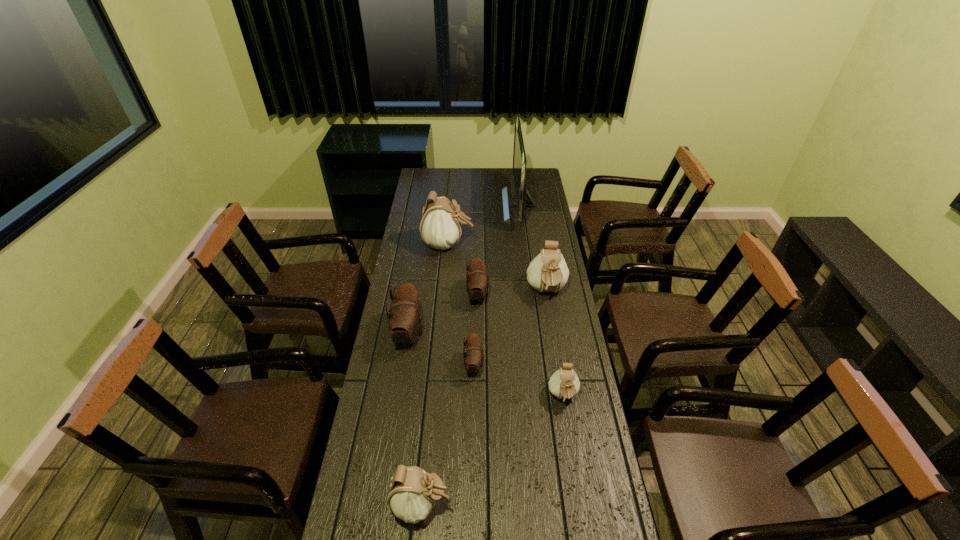
The height and width of the screenshot is (540, 960). What are the coordinates of `object at the far edge` in the screenshot? It's located at (519, 157).

Identify the location of monitor located in the right edge section of the desktop. The width and height of the screenshot is (960, 540). (519, 157).

Find the location of a particular element. object at the far right corner is located at coordinates (519, 157).

Locate an element on the screen. vacant space at the left edge of the desktop is located at coordinates (381, 458).

Identify the location of free spot at the right edge of the desktop. (538, 194).

Where is `vacant space at the far left corner of the desktop`? The width and height of the screenshot is (960, 540). vacant space at the far left corner of the desktop is located at coordinates (420, 182).

Identify the location of free space that is in between the nearest pouch and the farthest brown pouch. This screenshot has height=540, width=960. (449, 400).

At what (x,y) coordinates should I click in order to perform the action: click on vacant space that is in between the third farthest white pouch and the smallest brown pouch. Please return your answer as a coordinate pair (x, y). The height and width of the screenshot is (540, 960). Looking at the image, I should click on (518, 381).

Where is `unoccupied position between the monitor and the smallest white pouch`? Image resolution: width=960 pixels, height=540 pixels. unoccupied position between the monitor and the smallest white pouch is located at coordinates (540, 301).

Locate an element on the screen. The width and height of the screenshot is (960, 540). free space between the smallest white pouch and the tallest pouch is located at coordinates (506, 321).